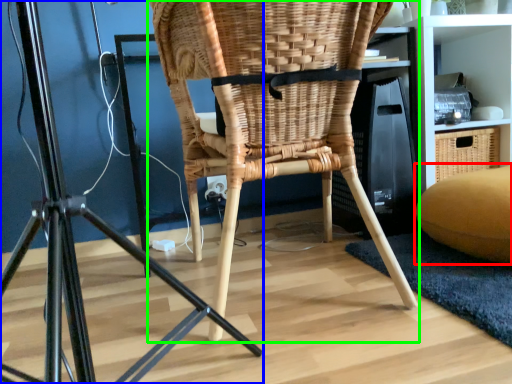
Question: Estimate the real-world distances between objects in this image. Which object is farther from bean bag chair (highlighted by a red box), furniture (highlighted by a blue box) or chair (highlighted by a green box)?

Choices:
 (A) furniture
 (B) chair

Answer: (A)